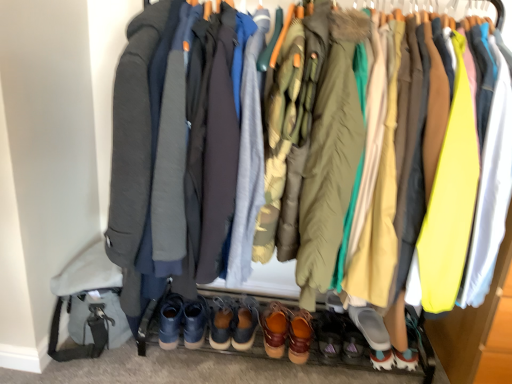
Question: From the image's perspective, is brown suede shoes at center, the seventh footwear viewed from the right, below gray rubber slipper at lower center, arranged as the first footwear when viewed from the right?

Choices:
 (A) no
 (B) yes

Answer: (A)

Question: Is brown suede shoes at center, the 1th footwear viewed from the left, positioned in front of gray rubber slipper at lower center, the seventh footwear from the left?

Choices:
 (A) no
 (B) yes

Answer: (A)

Question: Does brown suede shoes at center, the seventh footwear viewed from the right, have a greater height compared to gray rubber slipper at lower center, arranged as the first footwear when viewed from the right?

Choices:
 (A) yes
 (B) no

Answer: (A)

Question: Does brown suede shoes at center, the 1th footwear viewed from the left, appear on the left side of gray rubber slipper at lower center, the seventh footwear from the left?

Choices:
 (A) no
 (B) yes

Answer: (B)

Question: Is brown suede shoes at center, the 1th footwear viewed from the left, shorter than gray rubber slipper at lower center, the seventh footwear from the left?

Choices:
 (A) yes
 (B) no

Answer: (B)

Question: Considering the positions of matte gray jacket at center, arranged as the second jacket when viewed from the right, and brown suede shoes at center, the 1th footwear viewed from the left, in the image, is matte gray jacket at center, arranged as the second jacket when viewed from the right, wider or thinner than brown suede shoes at center, the 1th footwear viewed from the left,?

Choices:
 (A) wide
 (B) thin

Answer: (A)

Question: From the image's perspective, relative to brown suede shoes at center, the seventh footwear viewed from the right, is matte gray jacket at center, arranged as the second jacket when viewed from the right, above or below?

Choices:
 (A) above
 (B) below

Answer: (A)

Question: Considering the positions of matte gray jacket at center, arranged as the second jacket when viewed from the right, and brown suede shoes at center, the 1th footwear viewed from the left, in the image, is matte gray jacket at center, arranged as the second jacket when viewed from the right, bigger or smaller than brown suede shoes at center, the 1th footwear viewed from the left,?

Choices:
 (A) big
 (B) small

Answer: (A)

Question: From their relative heights in the image, would you say matte gray jacket at center, arranged as the second jacket when viewed from the right, is taller or shorter than brown suede shoes at center, the 1th footwear viewed from the left?

Choices:
 (A) tall
 (B) short

Answer: (A)

Question: From the image's perspective, relative to brown leather shoes at center, which appears as the fifth footwear when viewed from the right, is brown leather shoe at center, the 3th footwear in the right-to-left sequence, above or below?

Choices:
 (A) above
 (B) below

Answer: (B)

Question: Considering the positions of brown leather shoe at center, the 3th footwear in the right-to-left sequence, and brown leather shoes at center, the 3th footwear positioned from the left, in the image, is brown leather shoe at center, the 3th footwear in the right-to-left sequence, wider or thinner than brown leather shoes at center, the 3th footwear positioned from the left,?

Choices:
 (A) thin
 (B) wide

Answer: (B)

Question: Is brown leather shoe at center, the 3th footwear in the right-to-left sequence, taller or shorter than brown leather shoes at center, which appears as the fifth footwear when viewed from the right?

Choices:
 (A) tall
 (B) short

Answer: (B)

Question: Would you say brown leather shoe at center, which ranks as the 5th footwear in left-to-right order, is inside or outside brown leather shoes at center, the 3th footwear positioned from the left?

Choices:
 (A) inside
 (B) outside

Answer: (B)

Question: From a real-world perspective, relative to matte gray jacket at center, arranged as the second jacket when viewed from the right, is brown leather shoe at center, the 3th footwear in the right-to-left sequence, vertically above or below?

Choices:
 (A) above
 (B) below

Answer: (B)

Question: Considering the positions of brown leather shoe at center, which ranks as the 5th footwear in left-to-right order, and matte gray jacket at center, which ranks as the first jacket in left-to-right order, in the image, is brown leather shoe at center, which ranks as the 5th footwear in left-to-right order, wider or thinner than matte gray jacket at center, which ranks as the first jacket in left-to-right order,?

Choices:
 (A) thin
 (B) wide

Answer: (A)